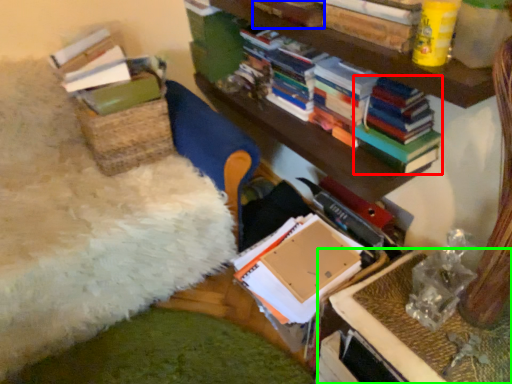
Question: Based on their relative distances, which object is farther from magazine (highlighted by a red box)? Choose from book (highlighted by a blue box) and table (highlighted by a green box).

Choices:
 (A) book
 (B) table

Answer: (B)